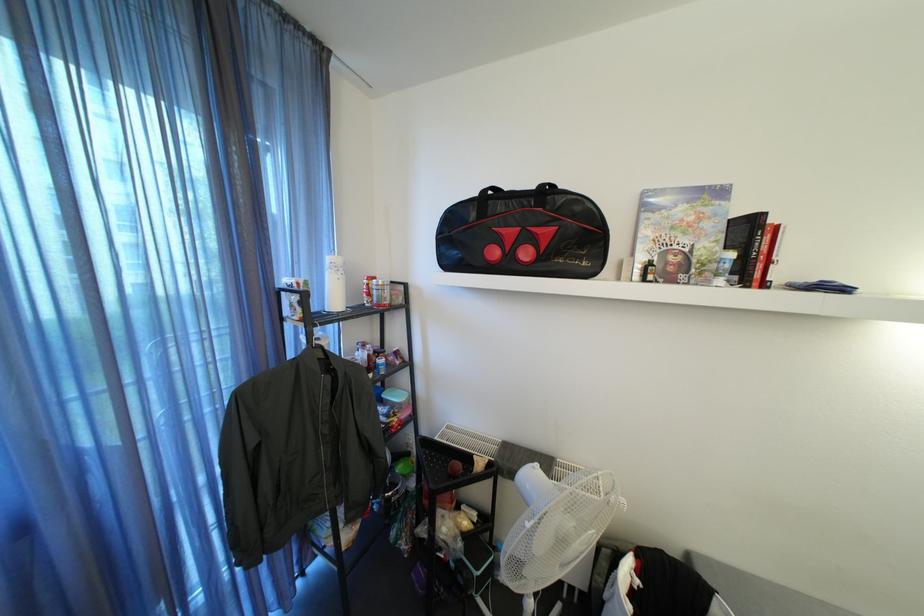
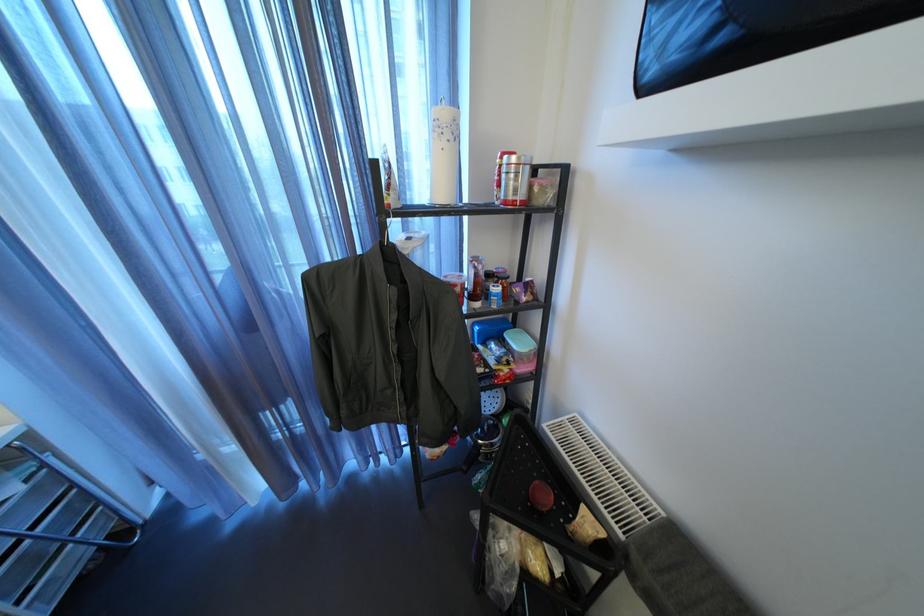
Based on the continuous images, in which direction is the camera rotating?

The camera's rotation is toward left-down.